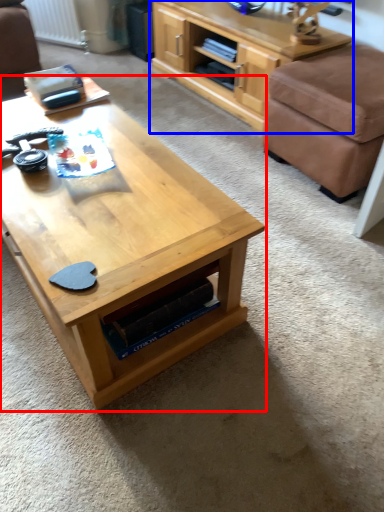
Question: Which point is further to the camera, coffee table (highlighted by a red box) or shelf (highlighted by a blue box)?

Choices:
 (A) coffee table
 (B) shelf

Answer: (B)